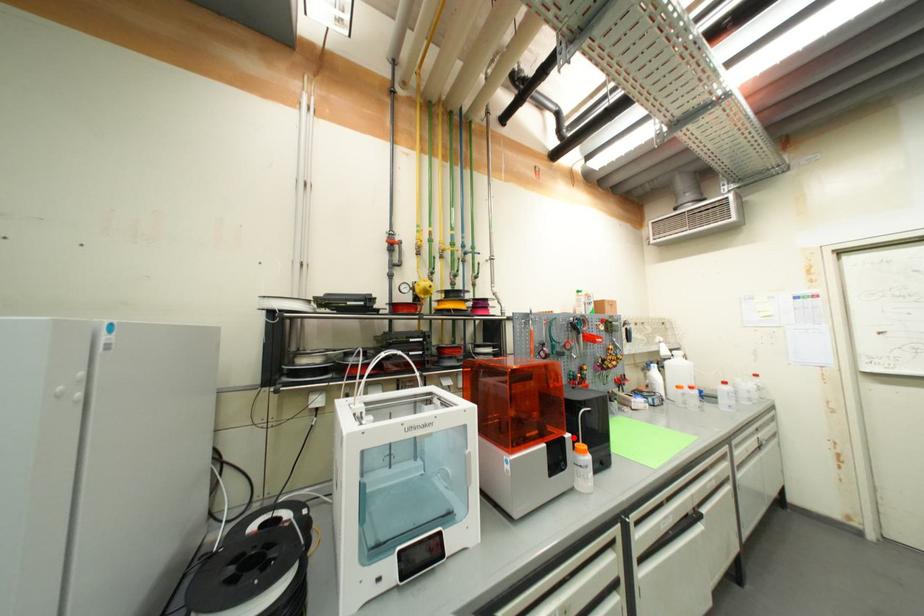
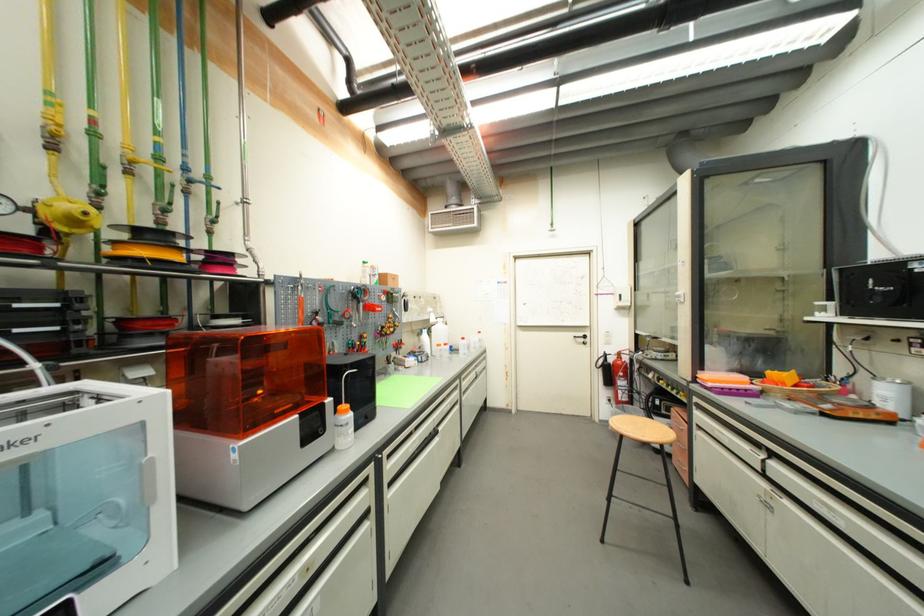
Question: I am providing you with two images of the same scene from different viewpoints. A red point is marked on the first image. Can you still see the location of the red point in image 2?

Choices:
 (A) Yes
 (B) No

Answer: (A)